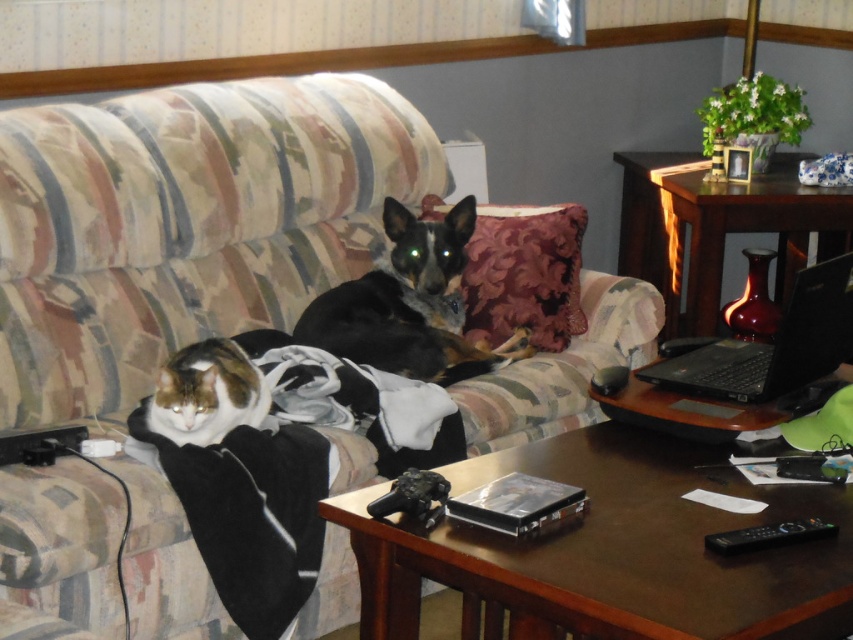
Which is more to the left, wooden table at right or black fur dog at center?

From the viewer's perspective, black fur dog at center appears more on the left side.

Does wooden table at right have a greater width compared to black fur dog at center?

Indeed, wooden table at right has a greater width compared to black fur dog at center.

Identify the location of wooden table at right. The height and width of the screenshot is (640, 853). (718, 227).

Can you confirm if wooden table at right is positioned to the right of black plastic laptop at right?

Yes, wooden table at right is to the right of black plastic laptop at right.

Between point (712, 225) and point (822, 332), which one is positioned behind?

The point (712, 225) is more distant.

The height and width of the screenshot is (640, 853). In order to click on wooden table at right in this screenshot , I will do `click(718, 227)`.

Identify the location of wooden table at right. The image size is (853, 640). (718, 227).

Who is taller, velvet-like burgundy pillow at center or fluffy white cat at lower left?

velvet-like burgundy pillow at center is taller.

Is velvet-like burgundy pillow at center thinner than fluffy white cat at lower left?

No.

Where is `velvet-like burgundy pillow at center`? velvet-like burgundy pillow at center is located at coordinates 525,273.